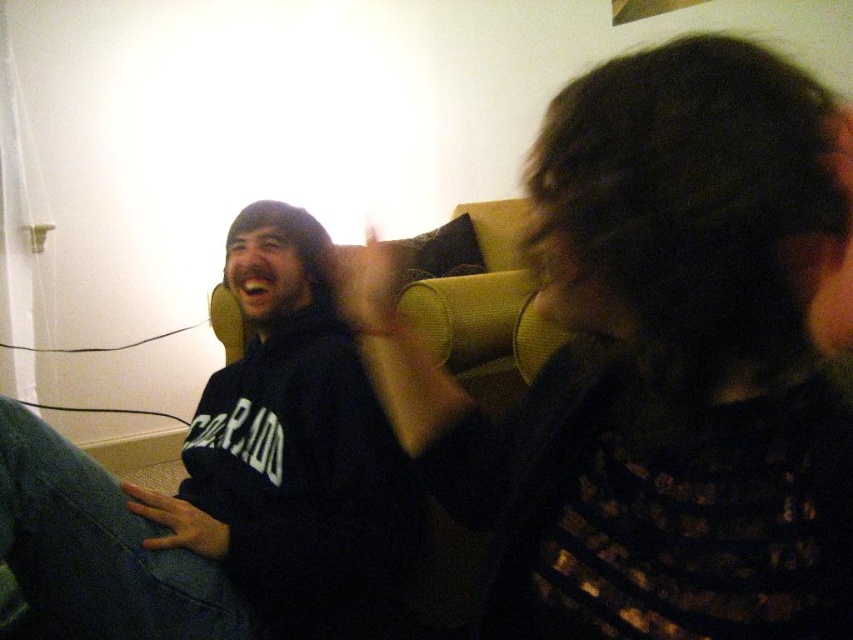
Question: Is dark textured hair at upper right to the left of black matte sweatshirt at left from the viewer's perspective?

Choices:
 (A) yes
 (B) no

Answer: (B)

Question: Does dark textured hair at upper right appear over black matte sweatshirt at left?

Choices:
 (A) yes
 (B) no

Answer: (A)

Question: Is dark textured hair at upper right further to the viewer compared to black matte sweatshirt at left?

Choices:
 (A) yes
 (B) no

Answer: (B)

Question: Which of the following is the closest to the observer?

Choices:
 (A) black matte sweatshirt at left
 (B) dark textured hair at upper right

Answer: (B)